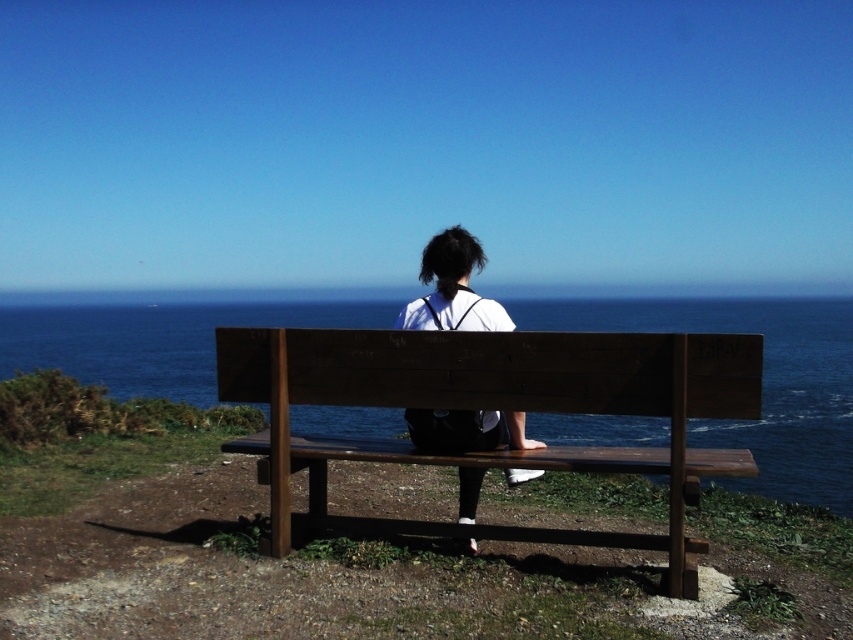
You are standing in front of the bench in the coastal scene. You notice two points marked on the bench. The first point is at coordinates point [358,529] and the second is at point [483,307]. If you want to place a small decoration closer to you on the bench, which point should you choose?

You should choose point [358,529] because it is closer to you than point [483,307].

You are a photographer trying to capture the entire scene of the blue water at center and the white matte shirt at center in one shot. Based on their positions and sizes, do you think you can fit both into the frame without cropping either of them?

The blue water at center might be wider than white matte shirt at center, so there is a possibility that the blue water at center could occupy more of the frame, but since both are at the center, they should fit within the frame without cropping.

You are standing in the coastal scene and want to sit down on the brown wooden bench at center. Before sitting, you notice the blue water at center behind the bench. How does the height of the bench compare to the water behind it?

The brown wooden bench at center is shorter than the blue water at center.